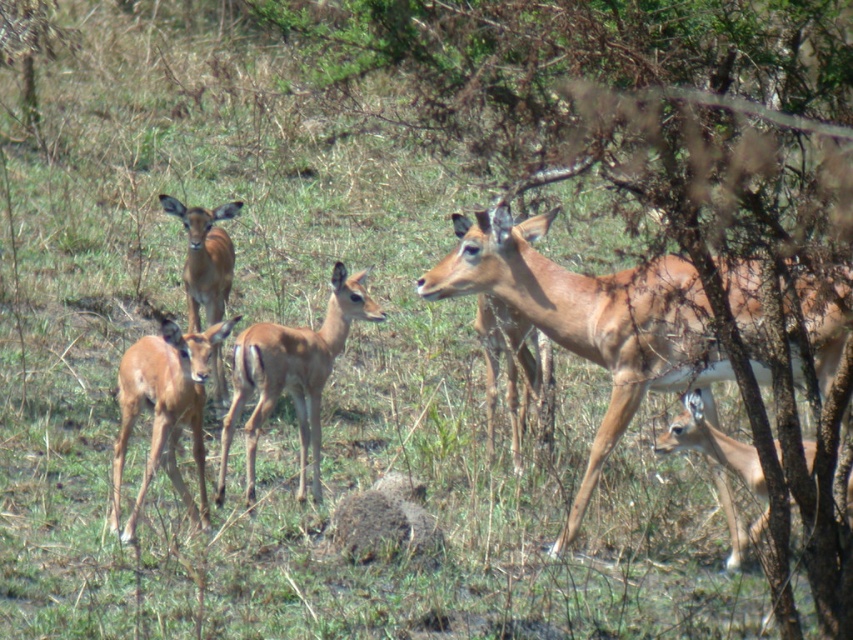
Between point (318, 344) and point (671, 420), which one is positioned in front?

Point (318, 344) is in front.

This screenshot has width=853, height=640. I want to click on brown smooth deer at center, so click(291, 376).

In order to click on brown smooth deer at center in this screenshot , I will do `click(291, 376)`.

Is brown matte/deer at lower right bigger than brown matte/deer at upper left?

Actually, brown matte/deer at lower right might be smaller than brown matte/deer at upper left.

Who is more distant from viewer, (682, 397) or (218, 256)?

Point (218, 256)

Which is in front, point (846, 490) or point (171, 204)?

Point (846, 490) is more forward.

This screenshot has height=640, width=853. What are the coordinates of `brown matte/deer at lower right` in the screenshot? It's located at (711, 444).

Can you confirm if light brown fur at right is smaller than brown matte/deer at lower right?

No, light brown fur at right is not smaller than brown matte/deer at lower right.

The height and width of the screenshot is (640, 853). Identify the location of light brown fur at right. (590, 321).